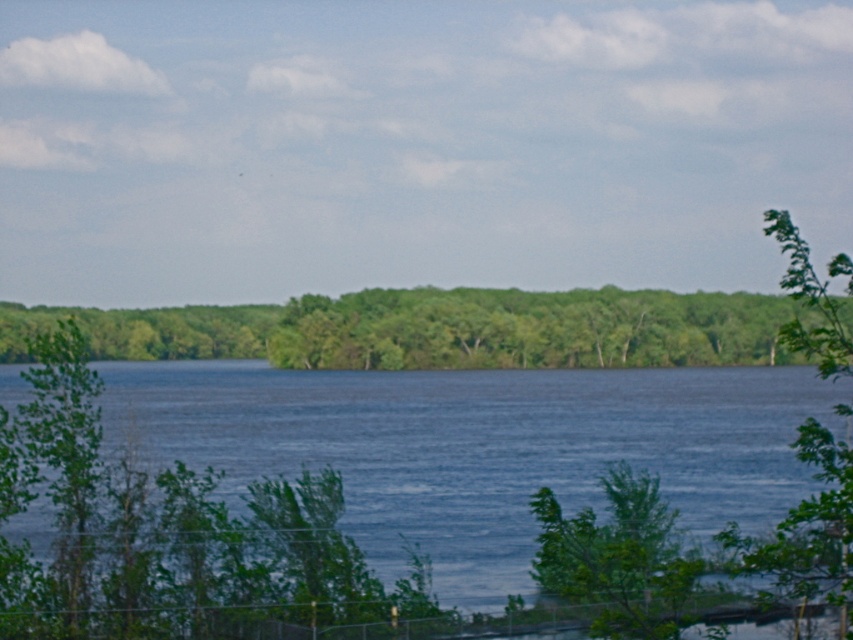
In the serene natural landscape, you notice the blue water at center and the green leafy trees at center. Which of these two elements takes up more space in the image?

The green leafy trees at center occupy more space than the blue water at center.

You are an environmental scientist assessing the health of this ecosystem. You observe the blue water at center and the green leafy tree at right. Which object occupies a larger area in the image?

The blue water at center has a larger size compared to the green leafy tree at right, so the blue water at center occupies a larger area in the image.